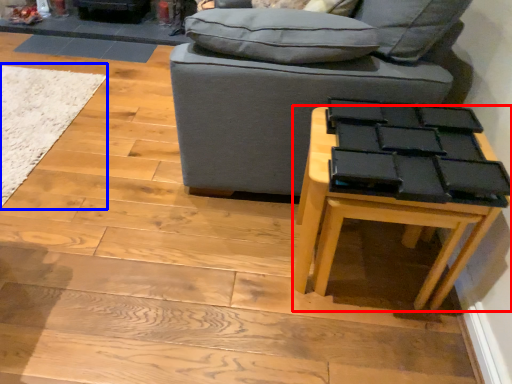
Question: Which point is closer to the camera, table (highlighted by a red box) or mat (highlighted by a blue box)?

Choices:
 (A) table
 (B) mat

Answer: (A)